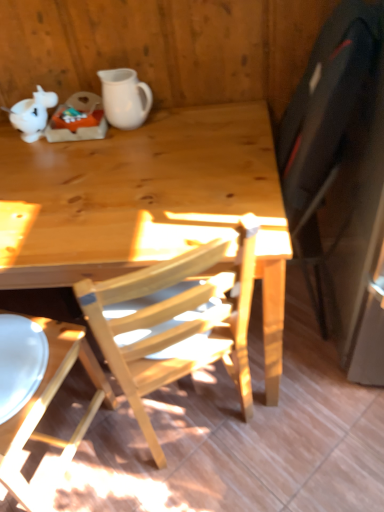
I want to click on vacant area that is in front of white matte teapot at upper left, so click(x=32, y=150).